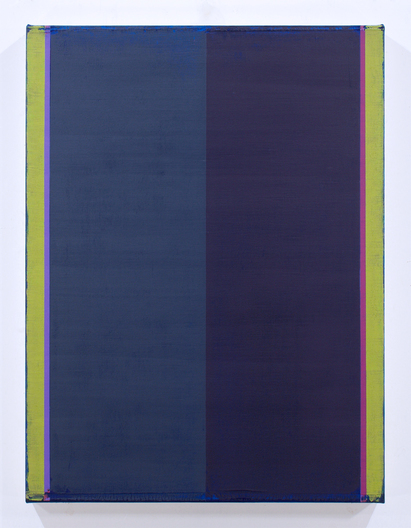
Find the location of a particular element. corner is located at coordinates (31, 27), (29, 498), (379, 498), (379, 27).